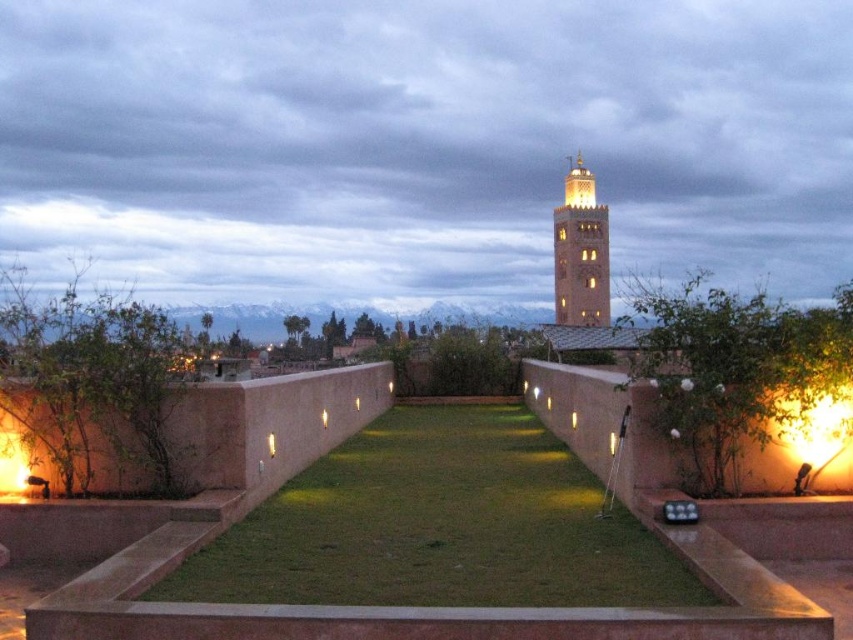
What do you see at coordinates (439, 525) in the screenshot? The height and width of the screenshot is (640, 853). I see `green grass at center` at bounding box center [439, 525].

Is point (381, 461) behind point (572, 253)?

No, it is not.

Is point (538, 561) in front of point (585, 316)?

Yes, it is in front of point (585, 316).

Image resolution: width=853 pixels, height=640 pixels. I want to click on green grass at center, so click(439, 525).